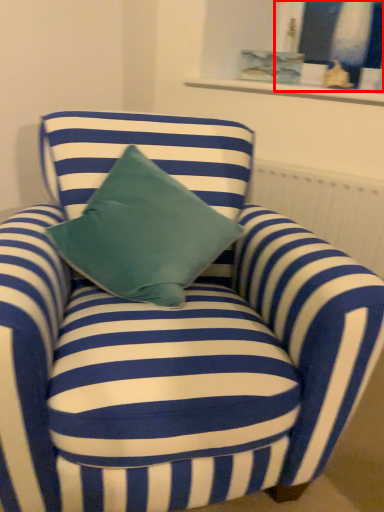
Question: From the image's perspective, where is window (annotated by the red box) located relative to radiator?

Choices:
 (A) below
 (B) above

Answer: (B)